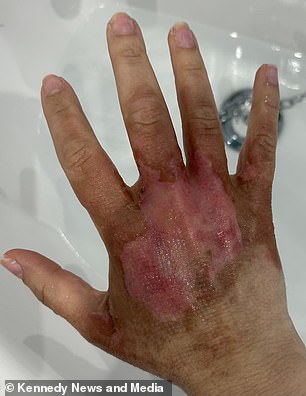
Find the location of a particular element. The width and height of the screenshot is (306, 396). sink drain is located at coordinates (237, 126), (279, 124), (240, 95).